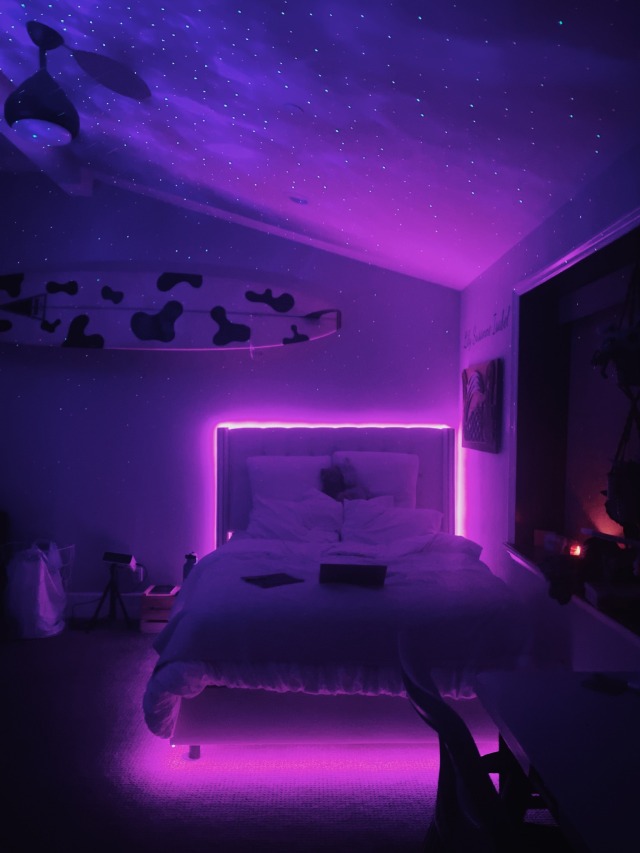
In order to click on painting in this screenshot , I will do `click(486, 395)`.